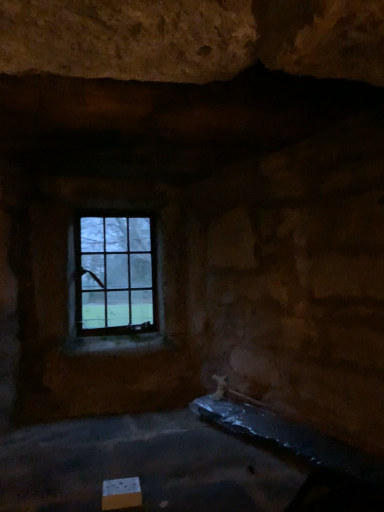
Locate an element on the screen. free location to the left of white cardboard box at lower left is located at coordinates (61, 494).